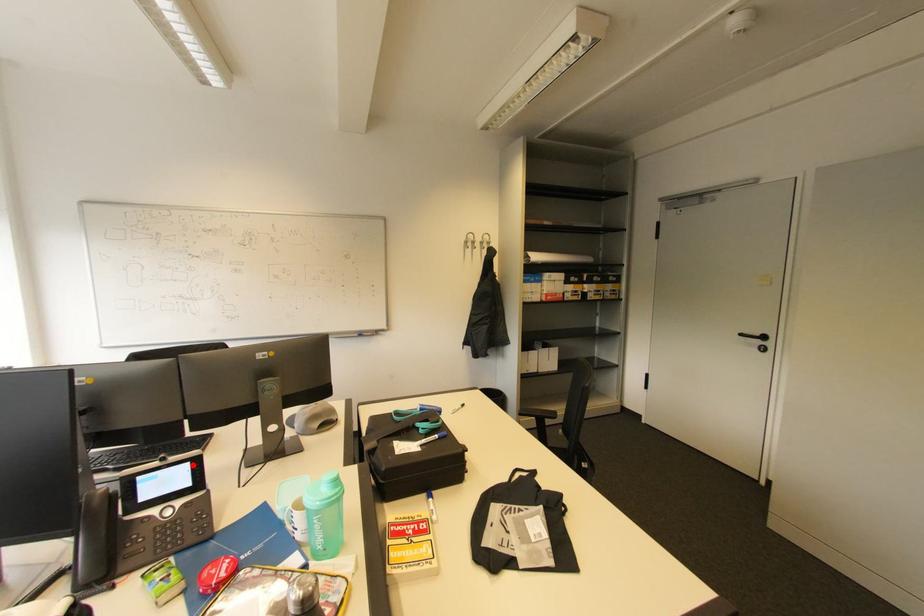
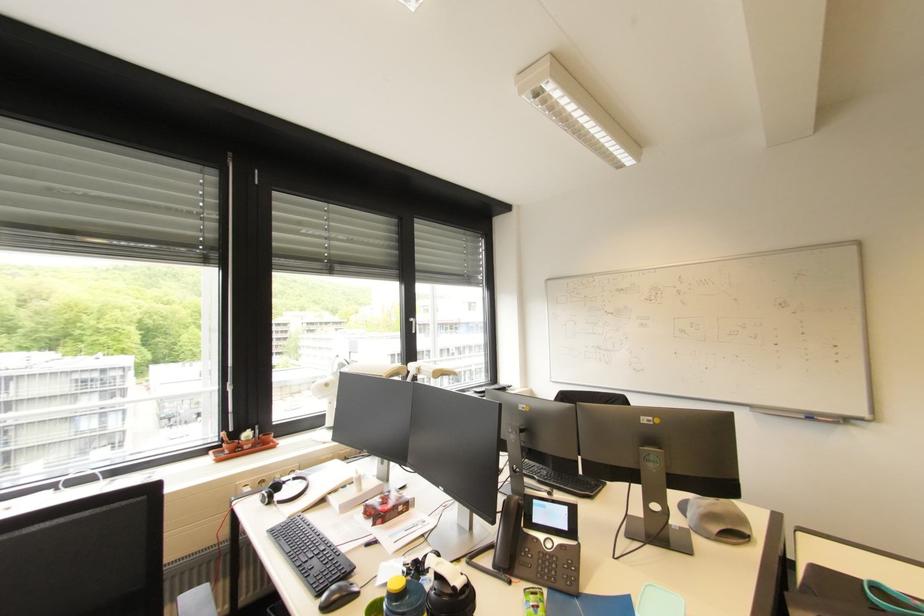
Where in the second image is the point corresponding to the highlighted location from the first image?

(572, 509)